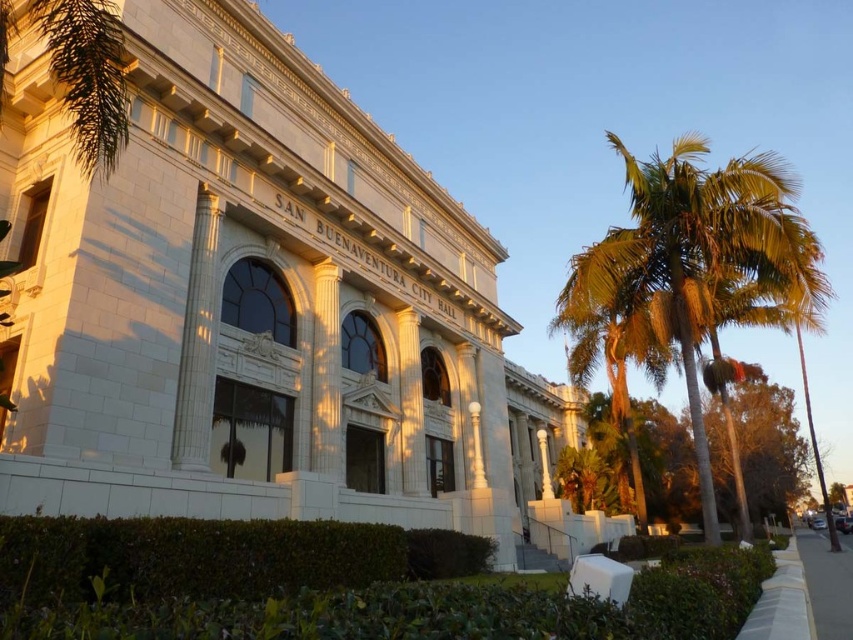
You are a visitor approaching the San Buenaventura City Hall and notice a green leafy palm tree at right and a gray concrete sidewalk at lower right. Which object is positioned more to the left side of the image?

The green leafy palm tree at right is positioned more to the left side of the image than the gray concrete sidewalk at lower right.

You are a city planner assessing the space in front of San Buenaventura City Hall. You need to determine if the green leafy palm tree at right can be placed on the gray concrete sidewalk at lower right without exceeding its width. Can it fit based on their dimensions?

The green leafy palm tree at right has a width less than the gray concrete sidewalk at lower right, so it can fit within the sidewalk without exceeding its width.

You are standing in front of the San Buenaventura City Hall and want to walk to the gray concrete sidewalk at lower right. There is a green leafy palm tree at right in your way. Can you walk around the tree to reach the sidewalk?

The green leafy palm tree at right is further to the viewer than the gray concrete sidewalk at lower right, so the tree is between you and the sidewalk. You cannot walk around the tree because it is in front of the sidewalk.